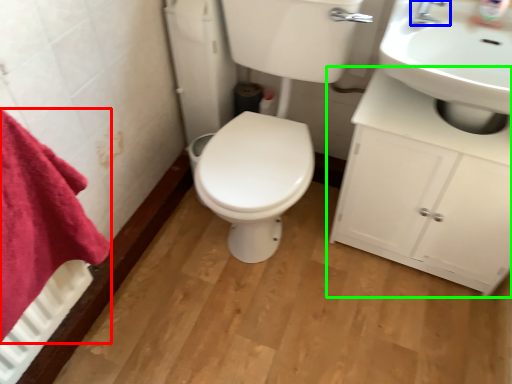
Question: Considering the real-world distances, which object is farthest from bath towel (highlighted by a red box)? tap (highlighted by a blue box) or bathroom cabinet (highlighted by a green box)?

Choices:
 (A) tap
 (B) bathroom cabinet

Answer: (A)